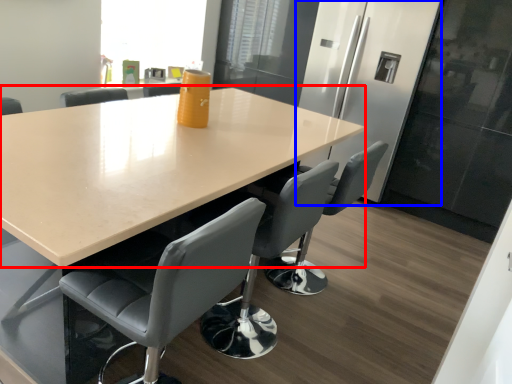
Question: Which object is closer to the camera taking this photo, table (highlighted by a red box) or fridge (highlighted by a blue box)?

Choices:
 (A) table
 (B) fridge

Answer: (A)